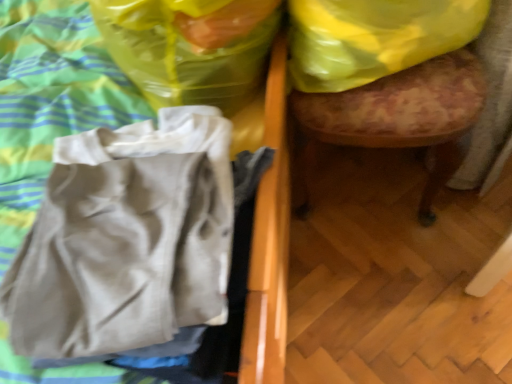
Question: Considering the positions of translucent yellow plastic bag at upper right, which ranks as the 2th plastic bag in right-to-left order, and yellow plastic bag at upper right, the 1th plastic bag viewed from the right, in the image, is translucent yellow plastic bag at upper right, which ranks as the 2th plastic bag in right-to-left order, taller or shorter than yellow plastic bag at upper right, the 1th plastic bag viewed from the right,?

Choices:
 (A) tall
 (B) short

Answer: (A)

Question: Considering the relative positions of translucent yellow plastic bag at upper right, which ranks as the 2th plastic bag in right-to-left order, and yellow plastic bag at upper right, the 1th plastic bag viewed from the right, in the image provided, is translucent yellow plastic bag at upper right, which ranks as the 2th plastic bag in right-to-left order, to the left or to the right of yellow plastic bag at upper right, the 1th plastic bag viewed from the right,?

Choices:
 (A) right
 (B) left

Answer: (B)

Question: Which object is positioned farthest from the wooden upholstered stool at right?

Choices:
 (A) yellow plastic bag at upper right, the 2th plastic bag from the left
 (B) translucent yellow plastic bag at upper right, which ranks as the 2th plastic bag in right-to-left order
 (C) beige cotton shirt at left

Answer: (C)

Question: Which object is positioned farthest from the yellow plastic bag at upper right, the 1th plastic bag viewed from the right?

Choices:
 (A) translucent yellow plastic bag at upper right, which ranks as the 1th plastic bag in left-to-right order
 (B) wooden upholstered stool at right
 (C) beige cotton shirt at left

Answer: (C)